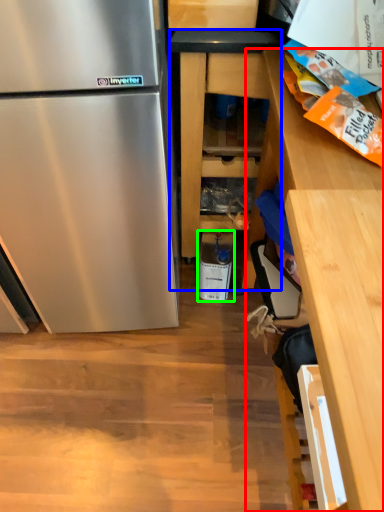
Question: Considering the real-world distances, which object is closest to cabinetry (highlighted by a red box)? cabinetry (highlighted by a blue box) or appliance (highlighted by a green box).

Choices:
 (A) cabinetry
 (B) appliance

Answer: (A)